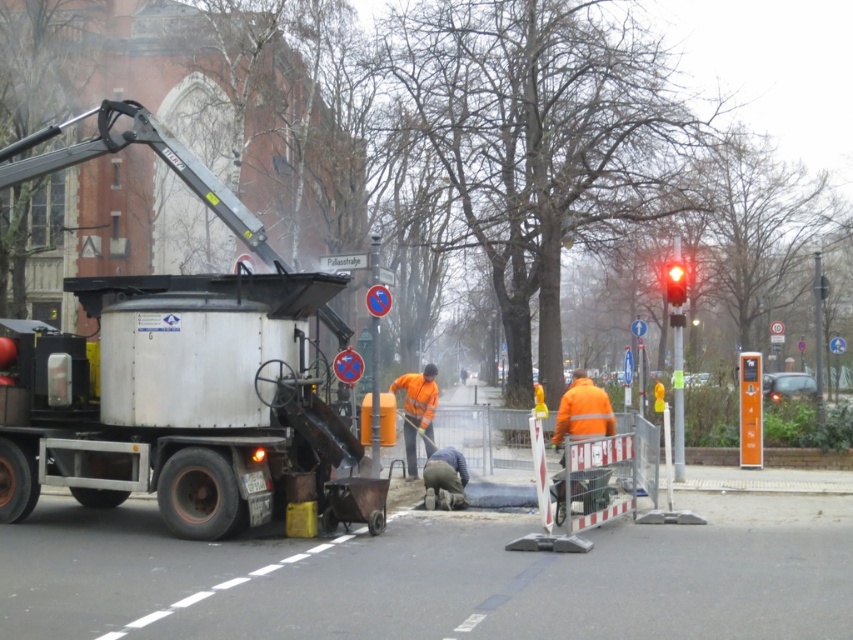
Question: Is silver metallic truck at left to the left of red glass traffic light at upper right from the viewer's perspective?

Choices:
 (A) yes
 (B) no

Answer: (A)

Question: Does silver metallic truck at left appear over red glass traffic light at upper right?

Choices:
 (A) yes
 (B) no

Answer: (B)

Question: Is silver metallic truck at left positioned in front of red glass traffic light at upper right?

Choices:
 (A) no
 (B) yes

Answer: (B)

Question: Which object appears closest to the camera in this image?

Choices:
 (A) silver metallic truck at left
 (B) red glass traffic light at upper right

Answer: (A)

Question: Among these points, which one is nearest to the camera?

Choices:
 (A) (668, 280)
 (B) (260, 276)

Answer: (B)

Question: Among these points, which one is farthest from the camera?

Choices:
 (A) 173,144
 (B) 669,301

Answer: (B)